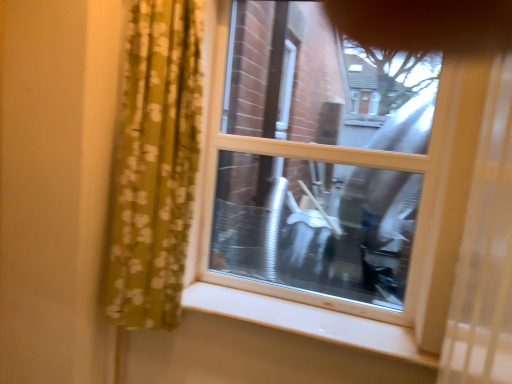
Question: From a real-world perspective, is transparent glass window at center above or below white smooth window sill at lower center?

Choices:
 (A) below
 (B) above

Answer: (B)

Question: Is transparent glass window at center spatially inside white smooth window sill at lower center, or outside of it?

Choices:
 (A) inside
 (B) outside

Answer: (B)

Question: Considering their positions, is transparent glass window at center located in front of or behind white smooth window sill at lower center?

Choices:
 (A) front
 (B) behind

Answer: (B)

Question: From the image's perspective, relative to transparent glass window at center, is white smooth window sill at lower center above or below?

Choices:
 (A) above
 (B) below

Answer: (B)

Question: Is point (192, 301) closer or farther from the camera than point (269, 288)?

Choices:
 (A) closer
 (B) farther

Answer: (A)

Question: Is white smooth window sill at lower center bigger or smaller than transparent glass window at center?

Choices:
 (A) big
 (B) small

Answer: (B)

Question: Is white smooth window sill at lower center inside the boundaries of transparent glass window at center, or outside?

Choices:
 (A) inside
 (B) outside

Answer: (B)